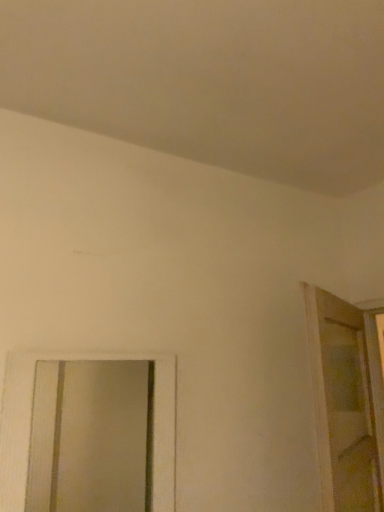
Image resolution: width=384 pixels, height=512 pixels. What do you see at coordinates (343, 404) in the screenshot?
I see `translucent glass screen door at right` at bounding box center [343, 404].

Locate an element on the screen. translucent glass screen door at right is located at coordinates (343, 404).

This screenshot has height=512, width=384. I want to click on translucent glass screen door at right, so click(x=343, y=404).